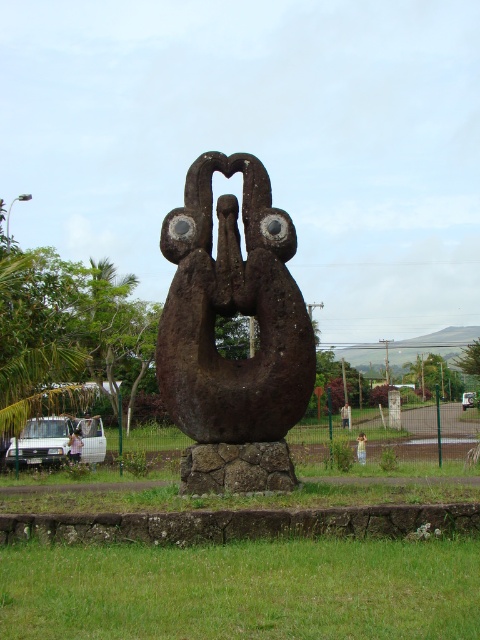
Is green grass at lower center below rusty stone sculpture at center?

Indeed, green grass at lower center is positioned under rusty stone sculpture at center.

The image size is (480, 640). Describe the element at coordinates (243, 589) in the screenshot. I see `green grass at lower center` at that location.

Who is more distant from viewer, (x=83, y=556) or (x=181, y=365)?

The point (x=181, y=365) is more distant.

Find the location of `green grass at lower center`. green grass at lower center is located at coordinates (243, 589).

Between point (255, 624) and point (360, 442), which one is positioned in front?

Point (255, 624) is in front.

Does point (39, 605) come in front of point (358, 454)?

That is True.

Locate an element on the screen. This screenshot has width=480, height=640. green grass at lower center is located at coordinates (243, 589).

Which is in front, point (80, 452) or point (340, 419)?

Point (80, 452)

Based on the photo, is white fabric at lower left above brown wooden statue at center?

Yes, white fabric at lower left is above brown wooden statue at center.

Find the location of a particular element. The image size is (480, 640). white fabric at lower left is located at coordinates (75, 445).